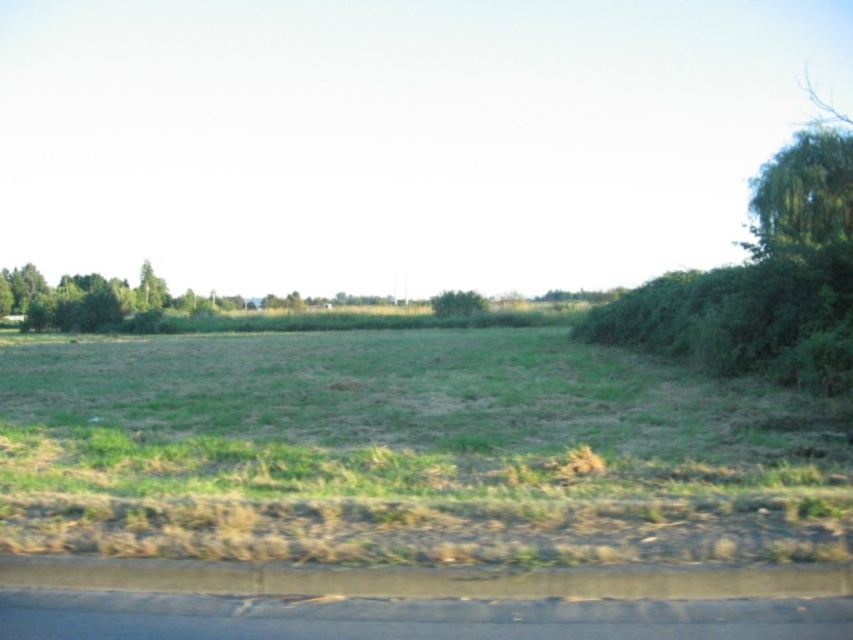
Question: Which point appears closest to the camera in this image?

Choices:
 (A) (138, 298)
 (B) (436, 300)

Answer: (B)

Question: Which object is farther from the camera taking this photo?

Choices:
 (A) green leafy tree at left
 (B) green leafy tree at center

Answer: (A)

Question: Does green leafy tree at upper right appear on the right side of green leafy tree at center?

Choices:
 (A) yes
 (B) no

Answer: (A)

Question: Can you confirm if green leafy tree at center is positioned above green leafy tree at left?

Choices:
 (A) yes
 (B) no

Answer: (B)

Question: Which of the following is the closest to the observer?

Choices:
 (A) (431, 304)
 (B) (798, 198)
 (C) (141, 292)

Answer: (B)

Question: Is green leafy tree at upper right positioned in front of green leafy tree at center?

Choices:
 (A) yes
 (B) no

Answer: (A)